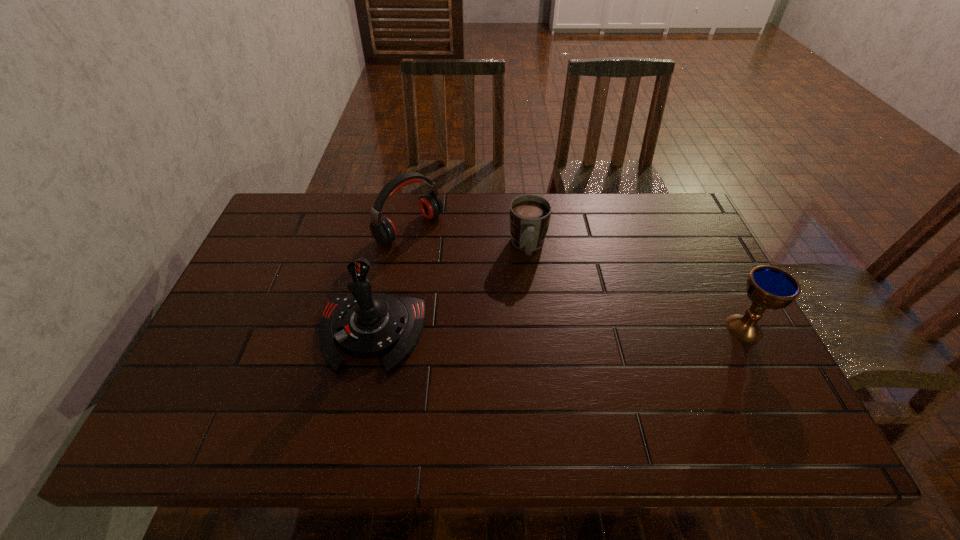
Locate an element on the screen. This screenshot has width=960, height=540. vacant space located on the side of the third object from left to right with the handle is located at coordinates (529, 295).

Where is `vacant space located 0.080m on the side of the third object from left to right with the handle`? vacant space located 0.080m on the side of the third object from left to right with the handle is located at coordinates (529, 287).

Where is `earphone that is at the far edge`? This screenshot has height=540, width=960. earphone that is at the far edge is located at coordinates (383, 230).

Identify the location of mug that is at the far edge. (530, 215).

This screenshot has width=960, height=540. I want to click on object that is at the near edge, so click(x=368, y=325).

Where is `object that is at the right edge`? Image resolution: width=960 pixels, height=540 pixels. object that is at the right edge is located at coordinates (768, 287).

The height and width of the screenshot is (540, 960). In the image, there is a desktop. In order to click on vacant space at the far edge in this screenshot , I will do `click(616, 234)`.

Where is `free space at the near edge of the desktop`? This screenshot has width=960, height=540. free space at the near edge of the desktop is located at coordinates (268, 370).

Find the location of `vacant region at the left edge`. vacant region at the left edge is located at coordinates pos(278,248).

Image resolution: width=960 pixels, height=540 pixels. In order to click on vacant space at the right edge in this screenshot , I will do `click(718, 346)`.